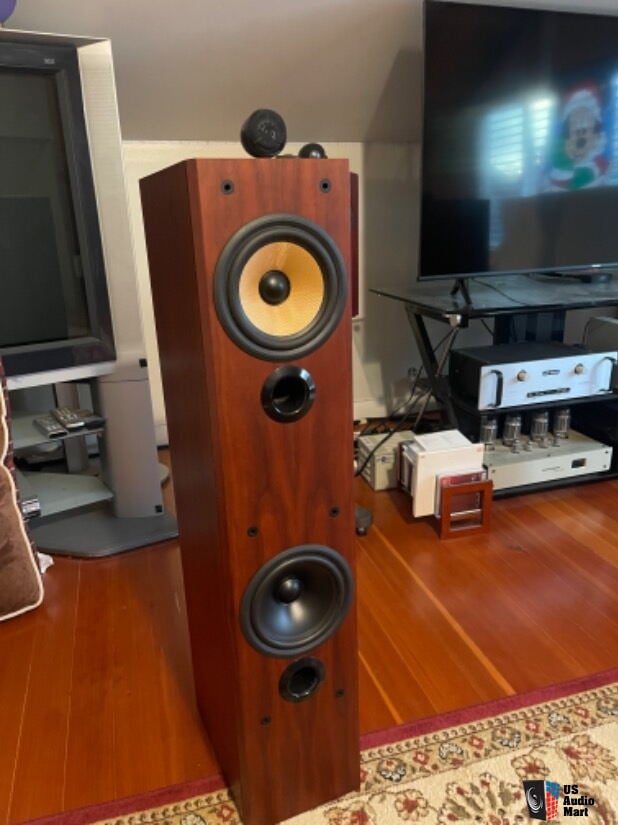
Identify the location of tower speaker. (260, 502).